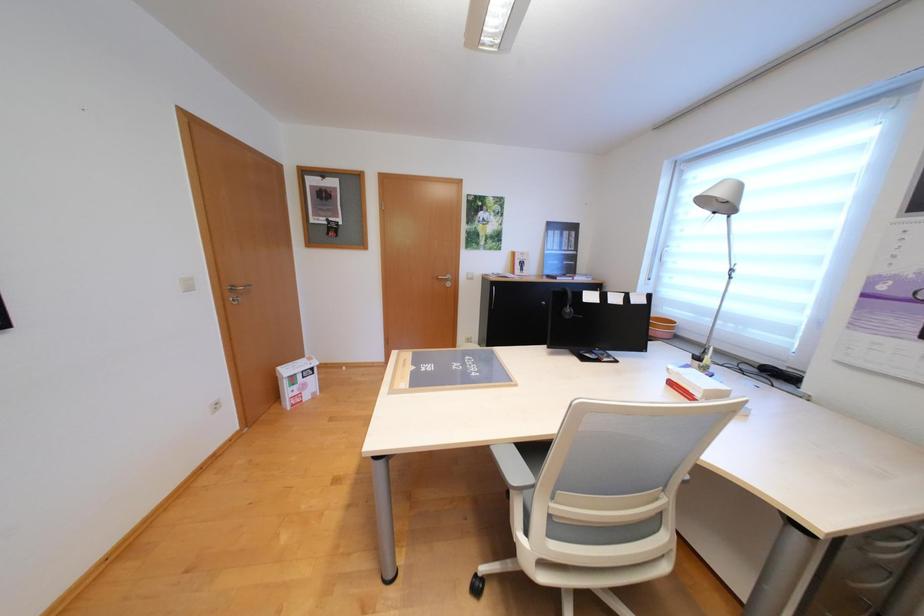
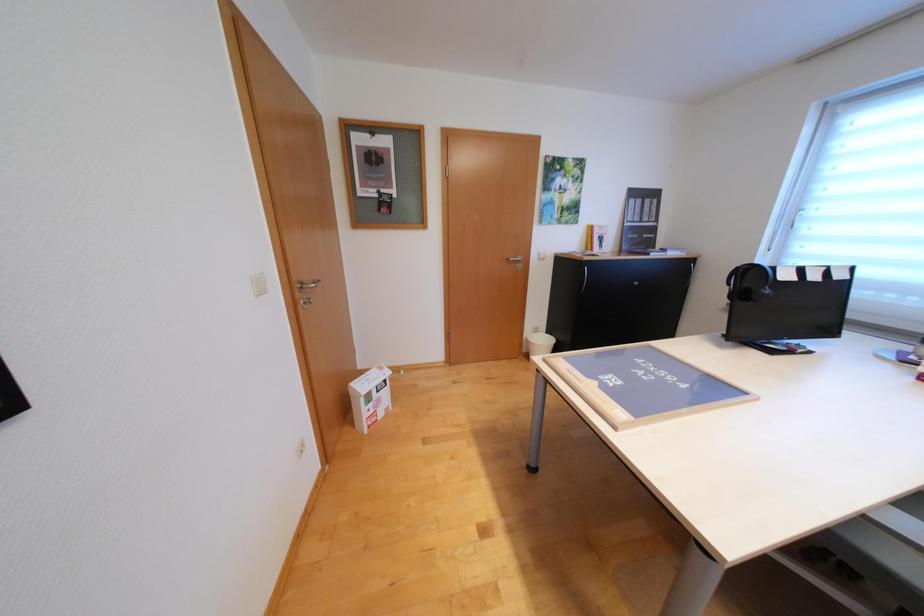
Question: Based on the continuous images, in which direction is the camera rotating? Reply with the corresponding letter.

Choices:
 (A) Left
 (B) Right
 (C) Up
 (D) Down

Answer: (D)